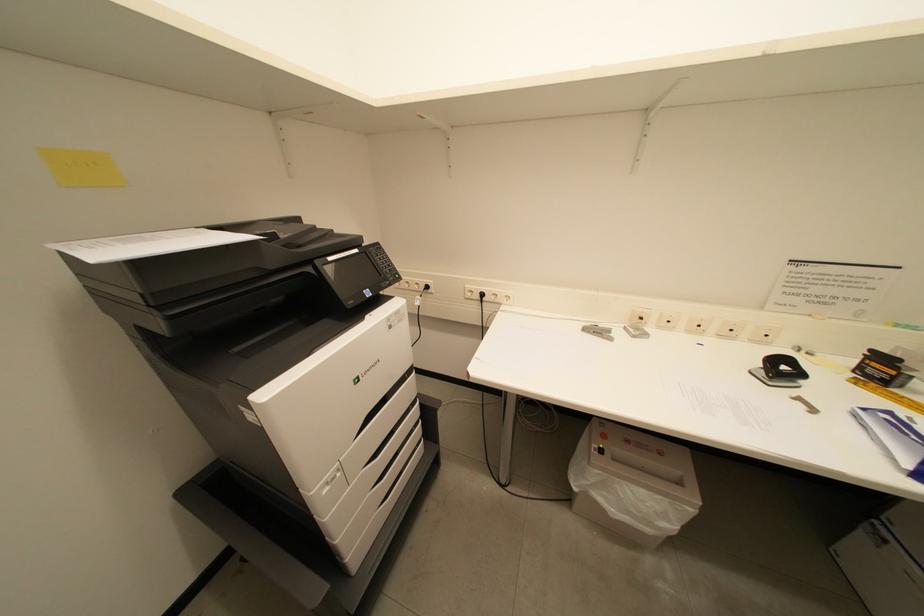
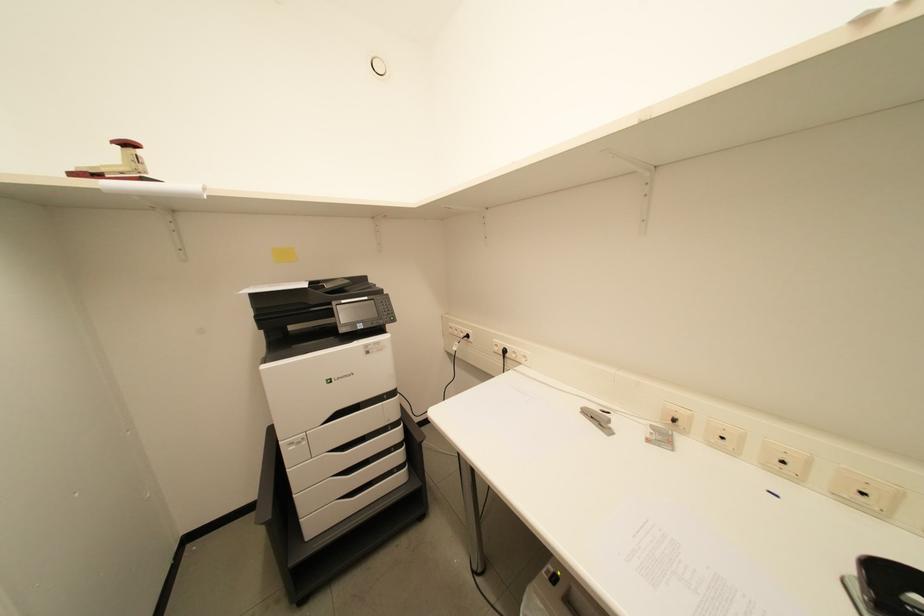
Question: The images are taken continuously from a first-person perspective. In which direction is your viewpoint rotating?

Choices:
 (A) Left
 (B) Right
 (C) Up
 (D) Down

Answer: (A)